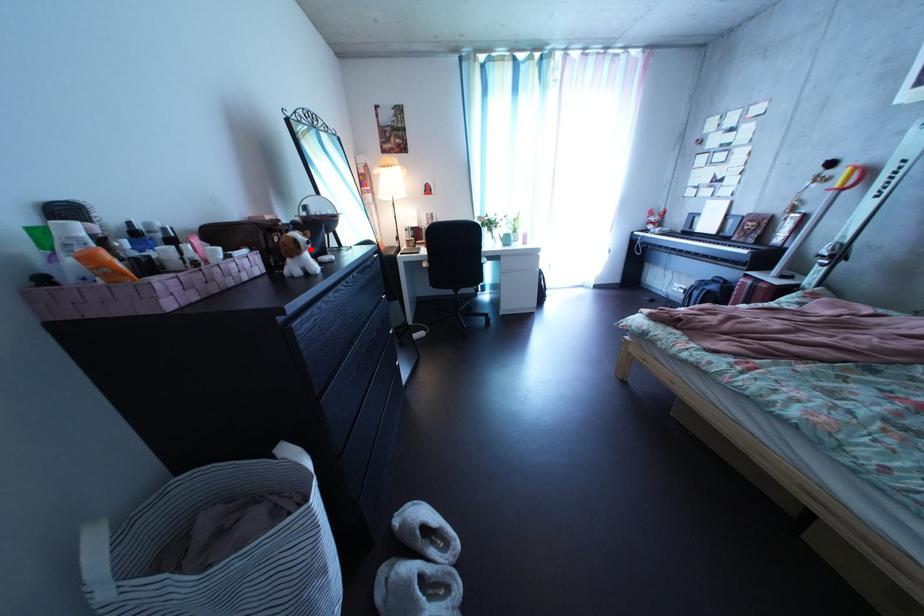
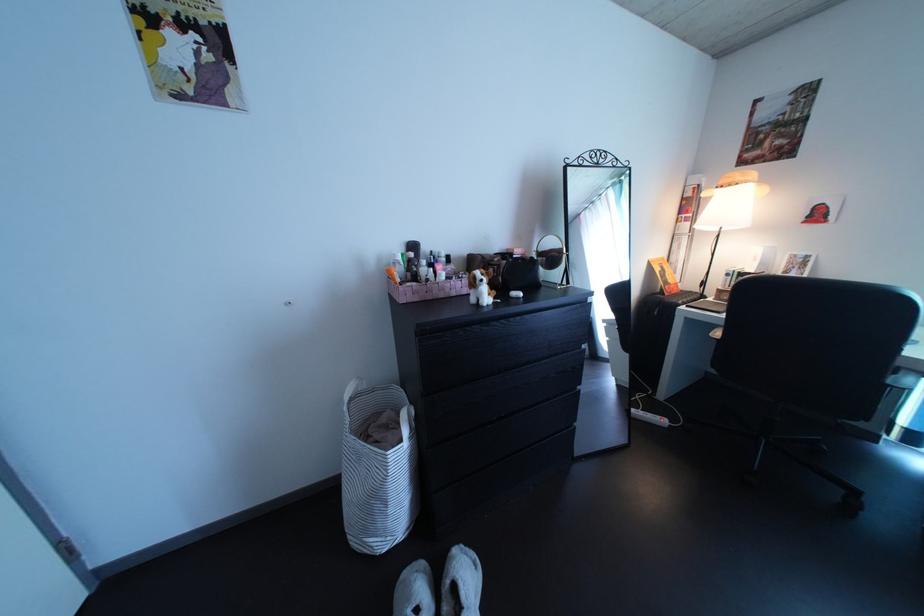
Find the pixel in the second image that matches the highlighted location in the first image.

(489, 286)